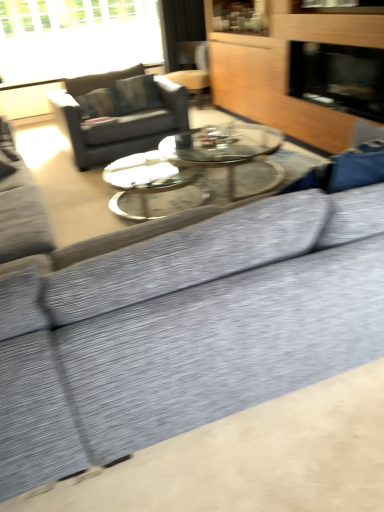
Question: Is wooden swivel chair at upper center at the left side of dark gray fabric couch at upper left?

Choices:
 (A) yes
 (B) no

Answer: (B)

Question: Does wooden swivel chair at upper center have a smaller size compared to dark gray fabric couch at upper left?

Choices:
 (A) yes
 (B) no

Answer: (A)

Question: Is the depth of wooden swivel chair at upper center greater than that of dark gray fabric couch at upper left?

Choices:
 (A) yes
 (B) no

Answer: (A)

Question: Is wooden swivel chair at upper center to the right of dark gray fabric couch at upper left from the viewer's perspective?

Choices:
 (A) yes
 (B) no

Answer: (A)

Question: Is dark gray fabric couch at upper left surrounded by wooden swivel chair at upper center?

Choices:
 (A) no
 (B) yes

Answer: (A)

Question: Choose the correct answer: Is wooden dresser at upper right inside transparent glass window at upper left or outside it?

Choices:
 (A) outside
 (B) inside

Answer: (A)

Question: Is wooden dresser at upper right to the left or to the right of transparent glass window at upper left in the image?

Choices:
 (A) right
 (B) left

Answer: (A)

Question: From a real-world perspective, is wooden dresser at upper right above or below transparent glass window at upper left?

Choices:
 (A) above
 (B) below

Answer: (B)

Question: Considering the positions of wooden dresser at upper right and transparent glass window at upper left in the image, is wooden dresser at upper right taller or shorter than transparent glass window at upper left?

Choices:
 (A) short
 (B) tall

Answer: (B)

Question: Is transparent glass window at upper left to the left or to the right of wooden dresser at upper right in the image?

Choices:
 (A) right
 (B) left

Answer: (B)

Question: From the image's perspective, is transparent glass window at upper left located above or below wooden dresser at upper right?

Choices:
 (A) below
 (B) above

Answer: (B)

Question: Considering the positions of transparent glass window at upper left and wooden dresser at upper right in the image, is transparent glass window at upper left bigger or smaller than wooden dresser at upper right?

Choices:
 (A) small
 (B) big

Answer: (A)

Question: In the image, is transparent glass window at upper left positioned in front of or behind wooden dresser at upper right?

Choices:
 (A) behind
 (B) front

Answer: (A)

Question: Considering the positions of transparent glass window at upper left and black glass fireplace at upper right in the image, is transparent glass window at upper left wider or thinner than black glass fireplace at upper right?

Choices:
 (A) thin
 (B) wide

Answer: (A)

Question: From the image's perspective, relative to black glass fireplace at upper right, is transparent glass window at upper left above or below?

Choices:
 (A) below
 (B) above

Answer: (B)